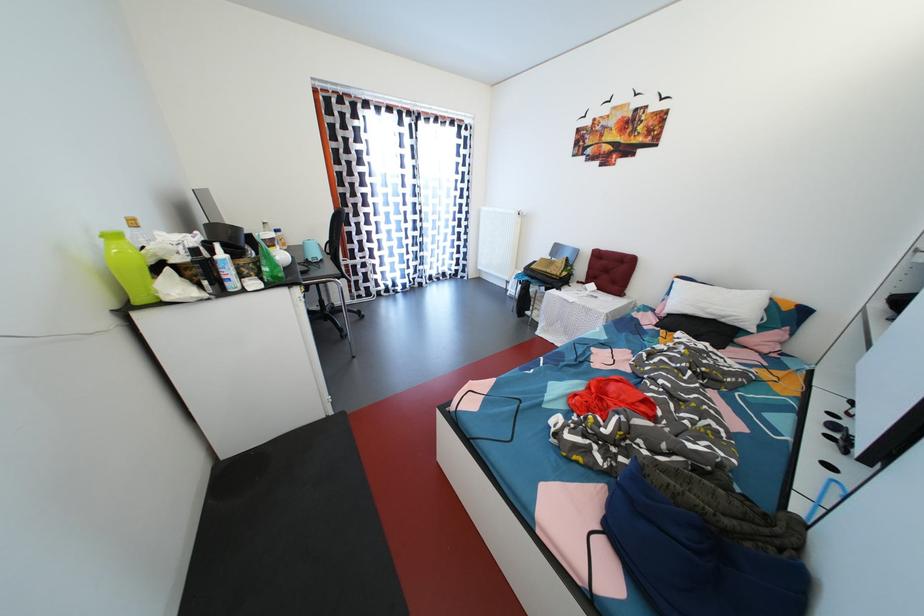
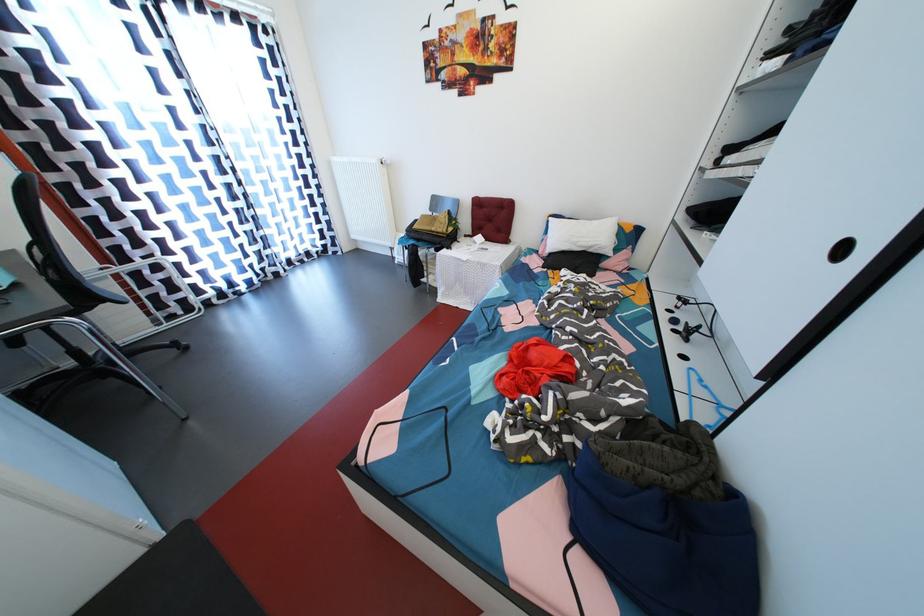
The point at (730, 318) is marked in the first image. Where is the corresponding point in the second image?

(597, 249)